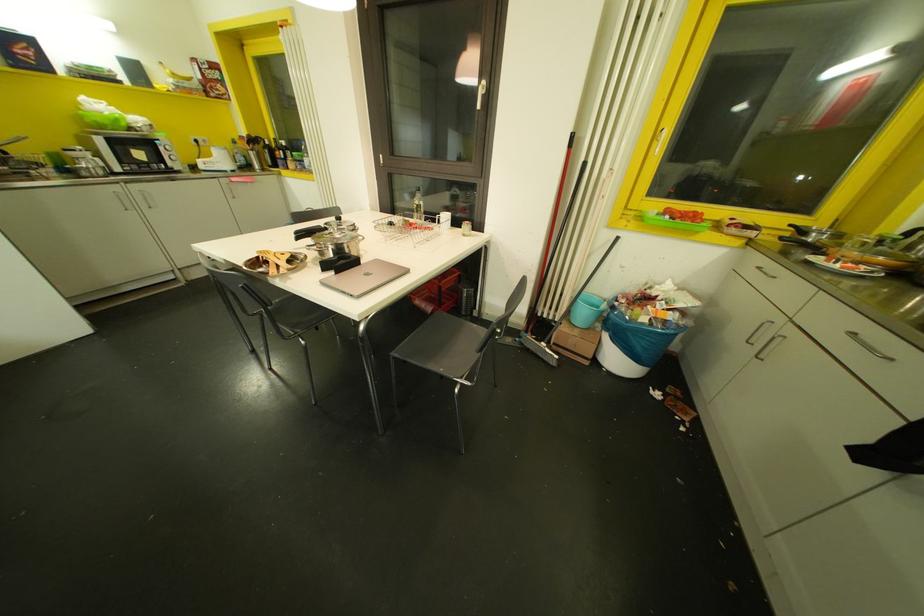
This screenshot has height=616, width=924. I want to click on chair sitting surface, so click(x=443, y=345).